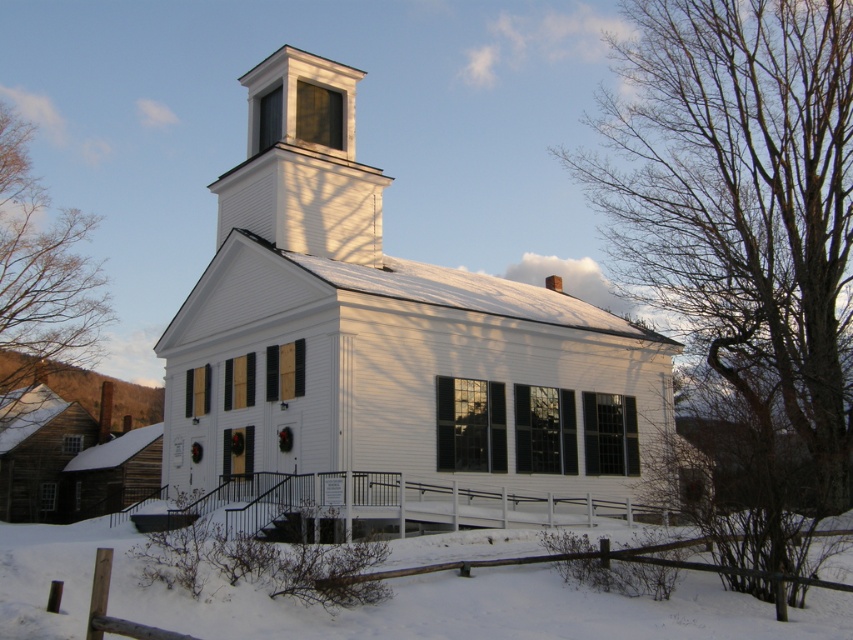
Is white matte church at center further to the viewer compared to brown leafless tree at left?

No, white matte church at center is in front of brown leafless tree at left.

Between white matte church at center and brown leafless tree at left, which one has less height?

white matte church at center is shorter.

The height and width of the screenshot is (640, 853). What do you see at coordinates (387, 352) in the screenshot?
I see `white matte church at center` at bounding box center [387, 352].

You are a GUI agent. You are given a task and a screenshot of the screen. Output one action in this format:
    pyautogui.click(x=<x>, y=<y>)
    Task: Click on the white matte church at center
    
    Given the screenshot: What is the action you would take?
    pyautogui.click(x=387, y=352)

Is white matte church at center taller than bare branches at right?

In fact, white matte church at center may be shorter than bare branches at right.

Which is in front, point (606, 467) or point (817, 1)?

Point (606, 467)

Does point (584, 512) lie in front of point (848, 108)?

Yes, it is in front of point (848, 108).

At what (x,y) coordinates should I click in order to perform the action: click on white matte church at center. Please return your answer as a coordinate pair (x, y). This screenshot has height=640, width=853. Looking at the image, I should click on (387, 352).

Can you confirm if white matte church at center is bigger than white powdery snow at lower center?

Indeed, white matte church at center has a larger size compared to white powdery snow at lower center.

Which of these two, white matte church at center or white powdery snow at lower center, stands taller?

With more height is white matte church at center.

Is point (526, 285) positioned before point (834, 611)?

No, it is behind (834, 611).

The image size is (853, 640). I want to click on white matte church at center, so click(x=387, y=352).